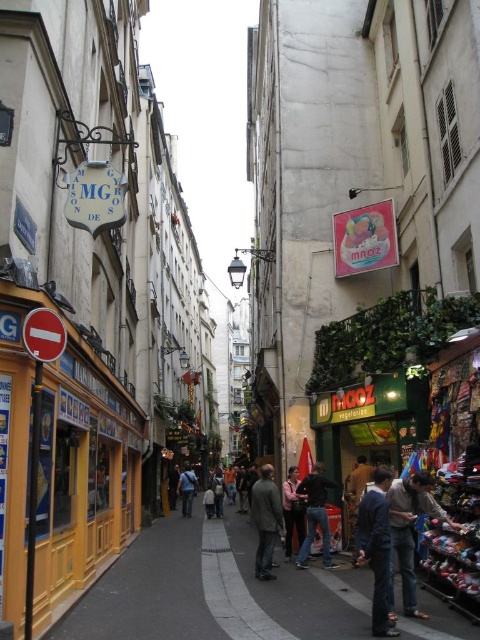
Question: Considering the relative positions of dark blue suit at center and pink fabric at center in the image provided, where is dark blue suit at center located with respect to pink fabric at center?

Choices:
 (A) left
 (B) right

Answer: (B)

Question: Estimate the real-world distances between objects in this image. Which object is closer to the smooth concrete pavement at center?

Choices:
 (A) dark blue suit at center
 (B) dark blue jeans at center
 (C) dark gray fabric jacket at center

Answer: (C)

Question: Is smooth concrete pavement at center wider than dark blue jeans at center?

Choices:
 (A) no
 (B) yes

Answer: (B)

Question: Which is farther from the light brown leather shoes at lower right?

Choices:
 (A) dark gray fabric jacket at center
 (B) dark blue suit at center

Answer: (A)

Question: Which object is farther from the camera taking this photo?

Choices:
 (A) light brown leather shoes at lower right
 (B) dark gray fabric jacket at center
 (C) dark blue suit at center

Answer: (B)

Question: Where is smooth concrete pavement at center located in relation to pink fabric at center in the image?

Choices:
 (A) above
 (B) below

Answer: (B)